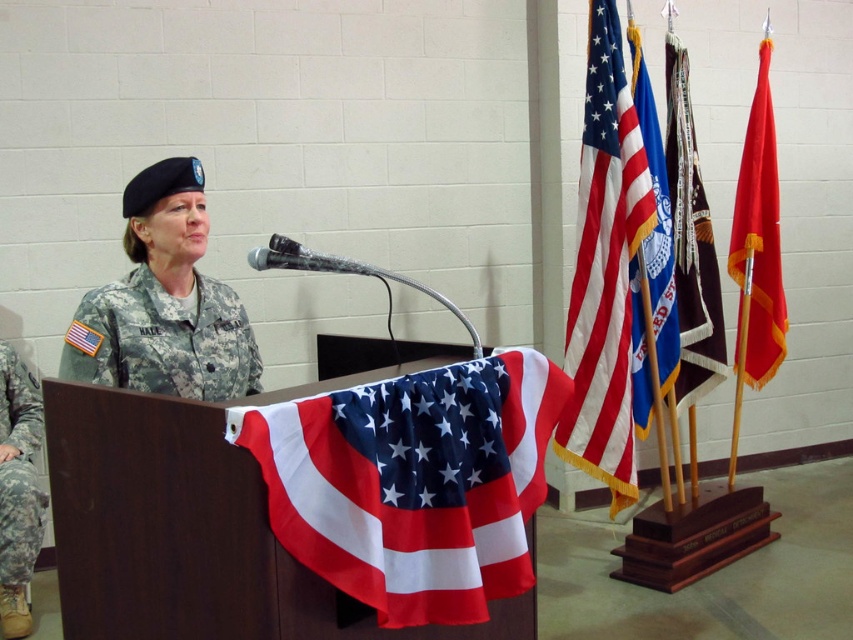
Can you confirm if smooth red flag at right is positioned to the left of textured gray microphone at center?

In fact, smooth red flag at right is to the right of textured gray microphone at center.

At what (x,y) coordinates should I click in order to perform the action: click on smooth red flag at right. Please return your answer as a coordinate pair (x, y). Image resolution: width=853 pixels, height=640 pixels. Looking at the image, I should click on (758, 243).

Which is more to the right, american flag at upper right or camouflage fabric uniform at center?

Positioned to the right is american flag at upper right.

Identify the location of american flag at upper right. The width and height of the screenshot is (853, 640). (605, 268).

Who is lower down, silky blue flag at center or camouflage fabric uniform at left?

camouflage fabric uniform at left is lower down.

Does silky blue flag at center have a larger size compared to camouflage fabric uniform at left?

Indeed, silky blue flag at center has a larger size compared to camouflage fabric uniform at left.

The height and width of the screenshot is (640, 853). I want to click on silky blue flag at center, so click(x=691, y=243).

Identify the location of silky blue flag at center. The height and width of the screenshot is (640, 853). (691, 243).